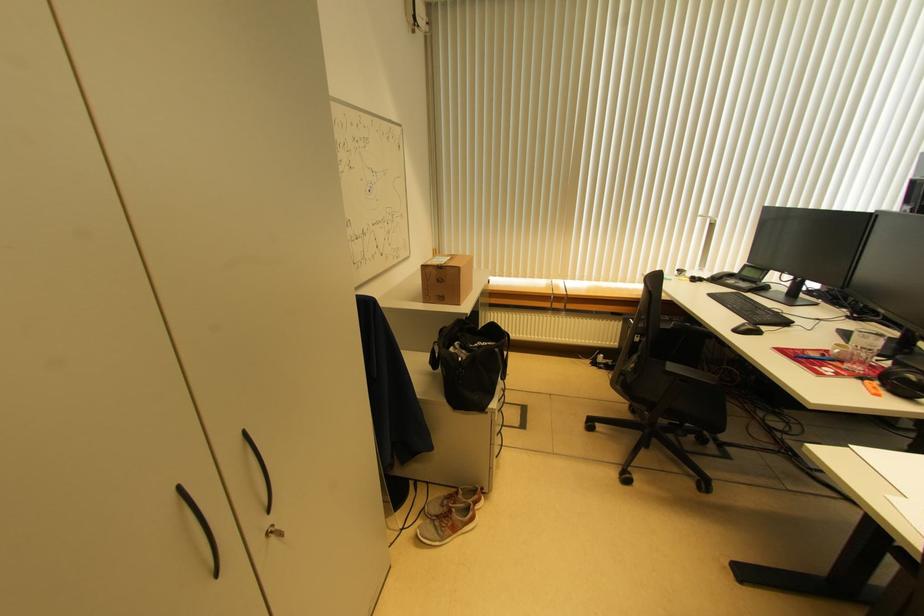
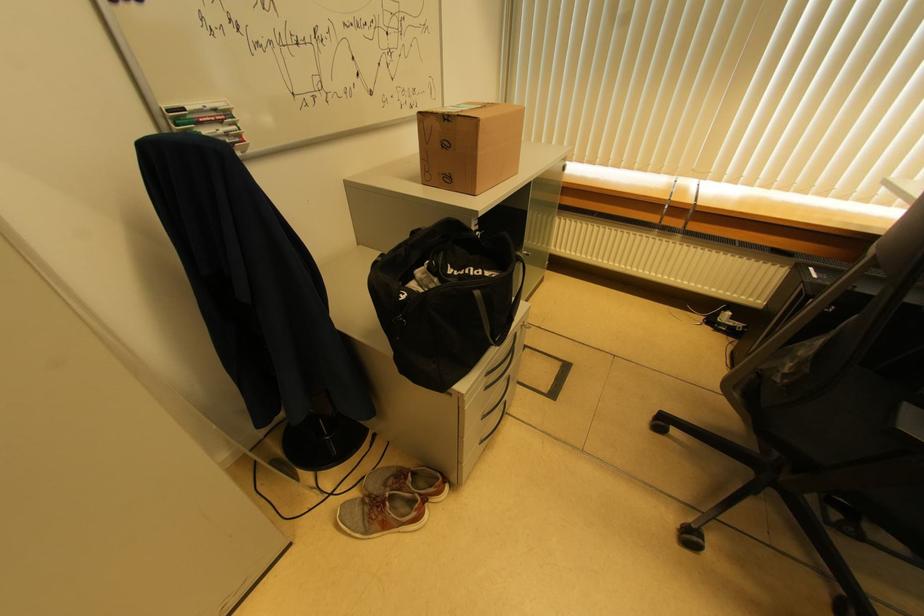
Locate, in the second image, the point that corresponds to point (450, 535) in the first image.

(379, 529)